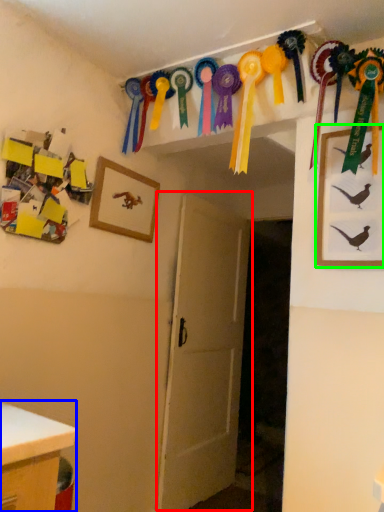
Question: Considering the real-world distances, which object is closest to door (highlighted by a red box)? desk (highlighted by a blue box) or picture frame (highlighted by a green box).

Choices:
 (A) desk
 (B) picture frame

Answer: (B)